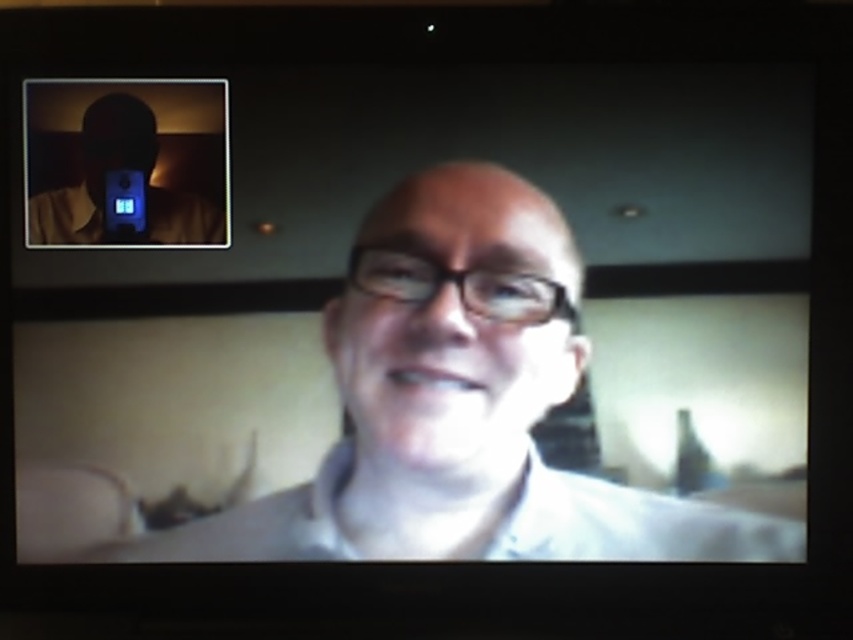
Question: Which point is farther to the camera?

Choices:
 (A) matte black phone at upper left
 (B) blue plastic video camera at upper left

Answer: (B)

Question: From the image, what is the correct spatial relationship of matte black phone at upper left in relation to blue plastic video camera at upper left?

Choices:
 (A) left
 (B) right

Answer: (B)

Question: Is matte black phone at upper left positioned in front of blue plastic video camera at upper left?

Choices:
 (A) no
 (B) yes

Answer: (B)

Question: Is matte black phone at upper left behind blue plastic video camera at upper left?

Choices:
 (A) no
 (B) yes

Answer: (A)